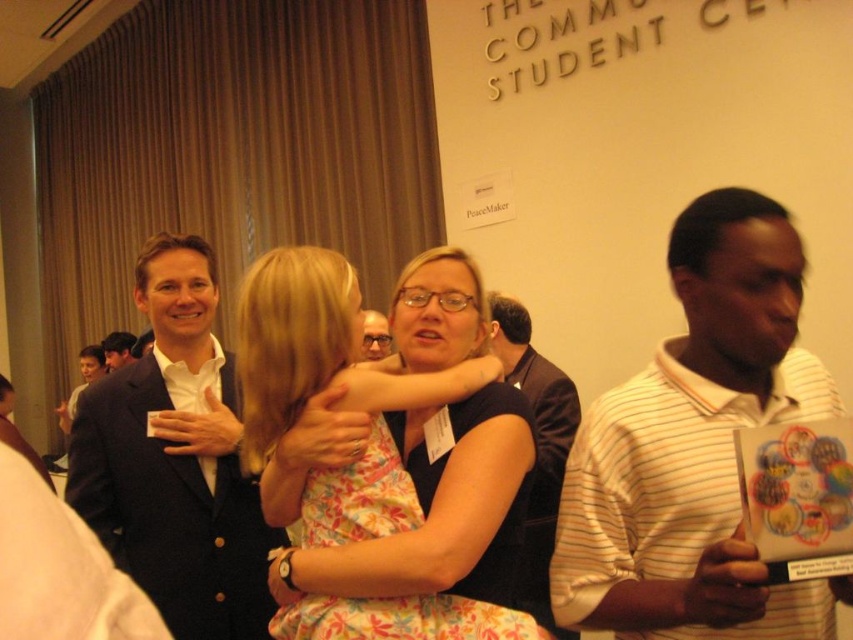
You are attending a formal event and want to take a photo of the dark brown suit at center and the matte black suit at center. Since you want both suits in focus, which one should you focus on first to ensure the other is also in focus?

You should focus on the dark brown suit at center first because it is closer to the viewer than the matte black suit at center. By focusing on the closer object, the depth of field will extend backward, potentially keeping both suits in focus.

You are at the event and want to locate the person wearing the matte black suit at center. Based on the description, which direction should you look relative to the white striped polo shirt at right?

The white striped polo shirt at right is to the right of the matte black suit at center, so you should look to your left from the white striped polo shirt at right to find the matte black suit at center.